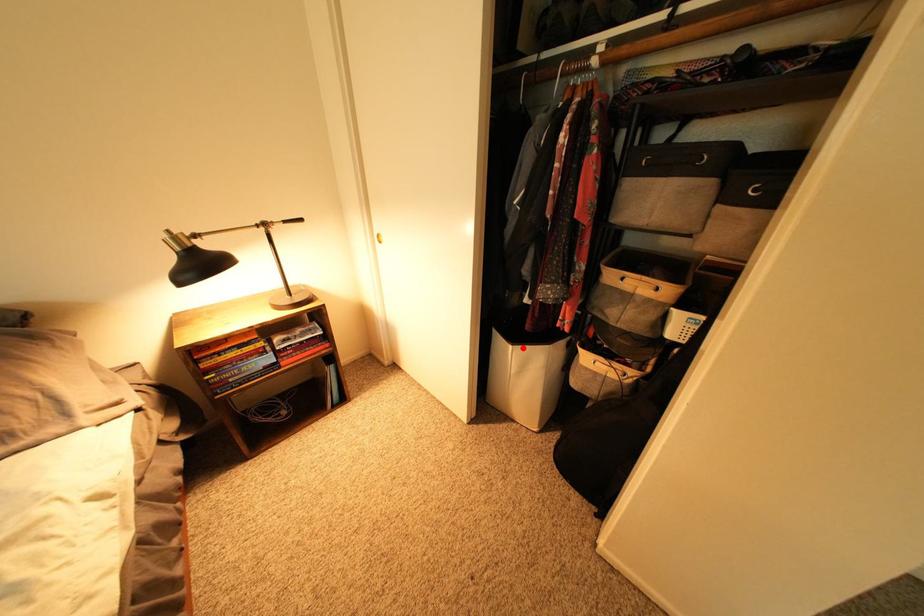
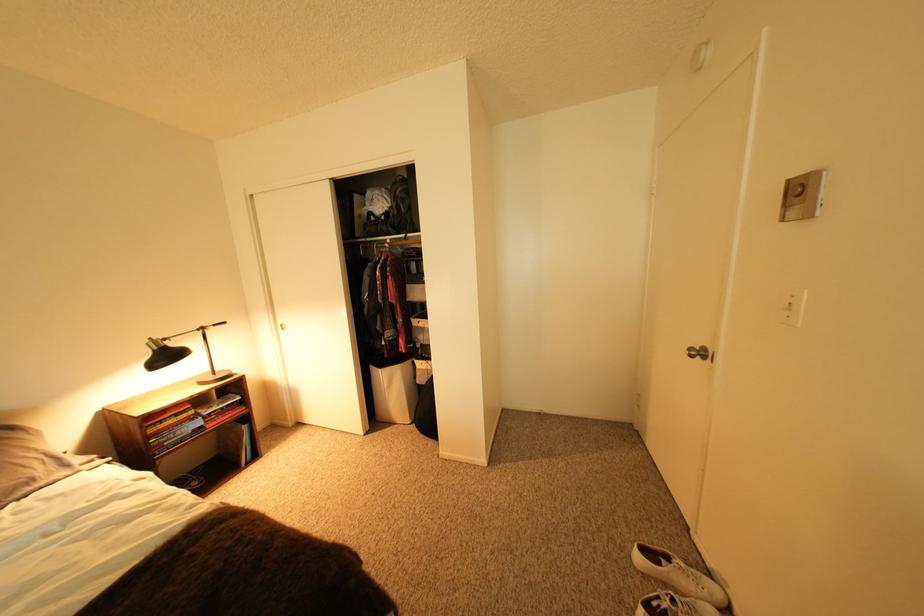
Find the pixel in the second image that matches the highlighted location in the first image.

(393, 371)